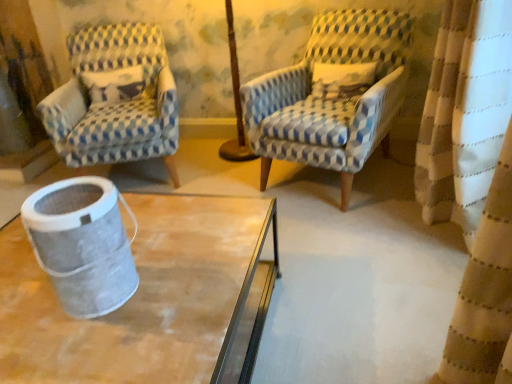
Find the location of a particular element. metallic mesh trash can at lower left is located at coordinates (82, 244).

Describe the element at coordinates (115, 99) in the screenshot. This screenshot has height=384, width=512. I see `blue and white checkered fabric armchair at left, the first chair positioned from the left` at that location.

At what (x,y) coordinates should I click in order to perform the action: click on blue and white checkered fabric armchair at center, arranged as the first chair when viewed from the right. Please return your answer as a coordinate pair (x, y). Looking at the image, I should click on (332, 97).

Which object is more forward, blue and white checkered fabric armchair at center, arranged as the first chair when viewed from the right, or blue and white checkered fabric armchair at left, the first chair positioned from the left?

Positioned in front is blue and white checkered fabric armchair at center, arranged as the first chair when viewed from the right.

Considering the relative sizes of blue and white checkered fabric armchair at center, arranged as the second chair when viewed from the left, and blue and white checkered fabric armchair at left, the first chair positioned from the left, in the image provided, is blue and white checkered fabric armchair at center, arranged as the second chair when viewed from the left, thinner than blue and white checkered fabric armchair at left, the first chair positioned from the left,?

Correct, the width of blue and white checkered fabric armchair at center, arranged as the second chair when viewed from the left, is less than that of blue and white checkered fabric armchair at left, the first chair positioned from the left.

Looking at the image, does blue and white checkered fabric armchair at center, arranged as the first chair when viewed from the right, seem bigger or smaller compared to blue and white checkered fabric armchair at left, the 2th chair positioned from the right?

In the image, blue and white checkered fabric armchair at center, arranged as the first chair when viewed from the right, appears to be smaller than blue and white checkered fabric armchair at left, the 2th chair positioned from the right.

Could you tell me if blue and white checkered fabric armchair at center, arranged as the second chair when viewed from the left, is facing blue and white checkered fabric armchair at left, the first chair positioned from the left?

No, blue and white checkered fabric armchair at center, arranged as the second chair when viewed from the left, is not oriented towards blue and white checkered fabric armchair at left, the first chair positioned from the left.

In order to click on chair that is the 1st one when counting upward from the metallic mesh trash can at lower left (from the image's perspective) in this screenshot , I will do `click(332, 97)`.

Is metallic mesh trash can at lower left at the back of blue and white checkered fabric armchair at center, arranged as the second chair when viewed from the left?

blue and white checkered fabric armchair at center, arranged as the second chair when viewed from the left, does not have its back to metallic mesh trash can at lower left.

How far apart are blue and white checkered fabric armchair at center, arranged as the second chair when viewed from the left, and metallic mesh trash can at lower left?

4.44 feet.

Does blue and white checkered fabric armchair at center, arranged as the first chair when viewed from the right, touch metallic mesh trash can at lower left?

blue and white checkered fabric armchair at center, arranged as the first chair when viewed from the right, and metallic mesh trash can at lower left are not in contact.

Considering the relative positions of blue and white checkered fabric armchair at left, the 2th chair positioned from the right, and metallic mesh trash can at lower left in the image provided, is blue and white checkered fabric armchair at left, the 2th chair positioned from the right, to the left of metallic mesh trash can at lower left from the viewer's perspective?

Yes.

Between blue and white checkered fabric armchair at left, the first chair positioned from the left, and metallic mesh trash can at lower left, which one has less height?

metallic mesh trash can at lower left is shorter.

Locate an element on the screen. the 2nd chair above the metallic mesh trash can at lower left (from the image's perspective) is located at coordinates (115, 99).

Between blue and white checkered fabric armchair at left, the first chair positioned from the left, and metallic mesh trash can at lower left, which one has larger width?

blue and white checkered fabric armchair at left, the first chair positioned from the left.

Looking at their sizes, would you say metallic mesh trash can at lower left is wider or thinner than blue and white checkered fabric armchair at left, the 2th chair positioned from the right?

metallic mesh trash can at lower left is thinner than blue and white checkered fabric armchair at left, the 2th chair positioned from the right.

Considering the positions of objects metallic mesh trash can at lower left and blue and white checkered fabric armchair at left, the first chair positioned from the left, in the image provided, who is more to the left, metallic mesh trash can at lower left or blue and white checkered fabric armchair at left, the first chair positioned from the left,?

blue and white checkered fabric armchair at left, the first chair positioned from the left.

Considering the sizes of metallic mesh trash can at lower left and blue and white checkered fabric armchair at left, the 2th chair positioned from the right, in the image, is metallic mesh trash can at lower left bigger or smaller than blue and white checkered fabric armchair at left, the 2th chair positioned from the right,?

In the image, metallic mesh trash can at lower left appears to be smaller than blue and white checkered fabric armchair at left, the 2th chair positioned from the right.

Can blue and white checkered fabric armchair at center, arranged as the first chair when viewed from the right, be found inside metallic mesh trash can at lower left?

No, blue and white checkered fabric armchair at center, arranged as the first chair when viewed from the right, is not inside metallic mesh trash can at lower left.

From the image's perspective, is metallic mesh trash can at lower left above blue and white checkered fabric armchair at center, arranged as the first chair when viewed from the right?

No.

Can you confirm if metallic mesh trash can at lower left is bigger than blue and white checkered fabric armchair at center, arranged as the first chair when viewed from the right?

Actually, metallic mesh trash can at lower left might be smaller than blue and white checkered fabric armchair at center, arranged as the first chair when viewed from the right.

Between blue and white checkered fabric armchair at left, the 2th chair positioned from the right, and blue and white checkered fabric armchair at center, arranged as the second chair when viewed from the left, which one is positioned behind?

blue and white checkered fabric armchair at left, the 2th chair positioned from the right, is more distant.

Which object is positioned more to the right, blue and white checkered fabric armchair at left, the first chair positioned from the left, or blue and white checkered fabric armchair at center, arranged as the first chair when viewed from the right?

Positioned to the right is blue and white checkered fabric armchair at center, arranged as the first chair when viewed from the right.

Is blue and white checkered fabric armchair at left, the 2th chair positioned from the right, positioned with its back to blue and white checkered fabric armchair at center, arranged as the second chair when viewed from the left?

No, blue and white checkered fabric armchair at left, the 2th chair positioned from the right,'s orientation is not away from blue and white checkered fabric armchair at center, arranged as the second chair when viewed from the left.

In order to click on chair behind the blue and white checkered fabric armchair at center, arranged as the second chair when viewed from the left in this screenshot , I will do `click(115, 99)`.

Locate an element on the screen. chair on the left of the blue and white checkered fabric armchair at center, arranged as the first chair when viewed from the right is located at coordinates (115, 99).

I want to click on chair that is the 1st one when counting backward from the metallic mesh trash can at lower left, so click(332, 97).

From the image, which object appears to be nearer to blue and white checkered fabric armchair at left, the 2th chair positioned from the right, metallic mesh trash can at lower left or blue and white checkered fabric armchair at center, arranged as the first chair when viewed from the right?

Based on the image, blue and white checkered fabric armchair at center, arranged as the first chair when viewed from the right, appears to be nearer to blue and white checkered fabric armchair at left, the 2th chair positioned from the right.

From the image, which object appears to be farther from metallic mesh trash can at lower left, blue and white checkered fabric armchair at center, arranged as the first chair when viewed from the right, or blue and white checkered fabric armchair at left, the 2th chair positioned from the right?

Among the two, blue and white checkered fabric armchair at left, the 2th chair positioned from the right, is located further to metallic mesh trash can at lower left.

Which object lies nearer to the anchor point metallic mesh trash can at lower left, blue and white checkered fabric armchair at left, the 2th chair positioned from the right, or blue and white checkered fabric armchair at center, arranged as the first chair when viewed from the right?

blue and white checkered fabric armchair at center, arranged as the first chair when viewed from the right, lies closer to metallic mesh trash can at lower left than the other object.

When comparing their distances from blue and white checkered fabric armchair at left, the 2th chair positioned from the right, does blue and white checkered fabric armchair at center, arranged as the first chair when viewed from the right, or metallic mesh trash can at lower left seem closer?

Based on the image, blue and white checkered fabric armchair at center, arranged as the first chair when viewed from the right, appears to be nearer to blue and white checkered fabric armchair at left, the 2th chair positioned from the right.

Looking at the image, which one is located further to blue and white checkered fabric armchair at center, arranged as the first chair when viewed from the right, metallic mesh trash can at lower left or blue and white checkered fabric armchair at left, the 2th chair positioned from the right?

metallic mesh trash can at lower left.

In the scene shown: Based on their spatial positions, is blue and white checkered fabric armchair at left, the 2th chair positioned from the right, or metallic mesh trash can at lower left closer to blue and white checkered fabric armchair at center, arranged as the second chair when viewed from the left?

blue and white checkered fabric armchair at left, the 2th chair positioned from the right.

This screenshot has width=512, height=384. What are the coordinates of `gray located between blue and white checkered fabric armchair at left, the 2th chair positioned from the right, and blue and white checkered fabric armchair at center, arranged as the second chair when viewed from the left, in the left-right direction` in the screenshot? It's located at (82, 244).